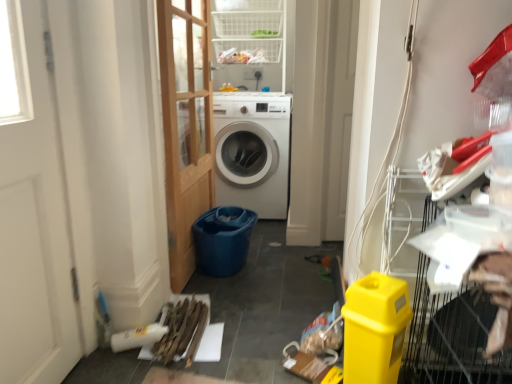
Question: In terms of width, does blue plastic bucket at center look wider or thinner when compared to white glossy washing machine at center?

Choices:
 (A) wide
 (B) thin

Answer: (B)

Question: Considering the positions of blue plastic bucket at center and white glossy washing machine at center in the image, is blue plastic bucket at center taller or shorter than white glossy washing machine at center?

Choices:
 (A) short
 (B) tall

Answer: (A)

Question: Which of these objects is positioned closest to the white wood screen door at left?

Choices:
 (A) white glossy washing machine at center
 (B) blue plastic bucket at center
 (C) white plastic shelf at upper center
 (D) yellow plastic bin at lower right
 (E) wooden door at center

Answer: (E)

Question: Estimate the real-world distances between objects in this image. Which object is farther from the wooden door at center?

Choices:
 (A) white glossy washing machine at center
 (B) yellow plastic bin at lower right
 (C) white plastic shelf at upper center
 (D) blue plastic bucket at center
 (E) wooden planks at lower left

Answer: (B)